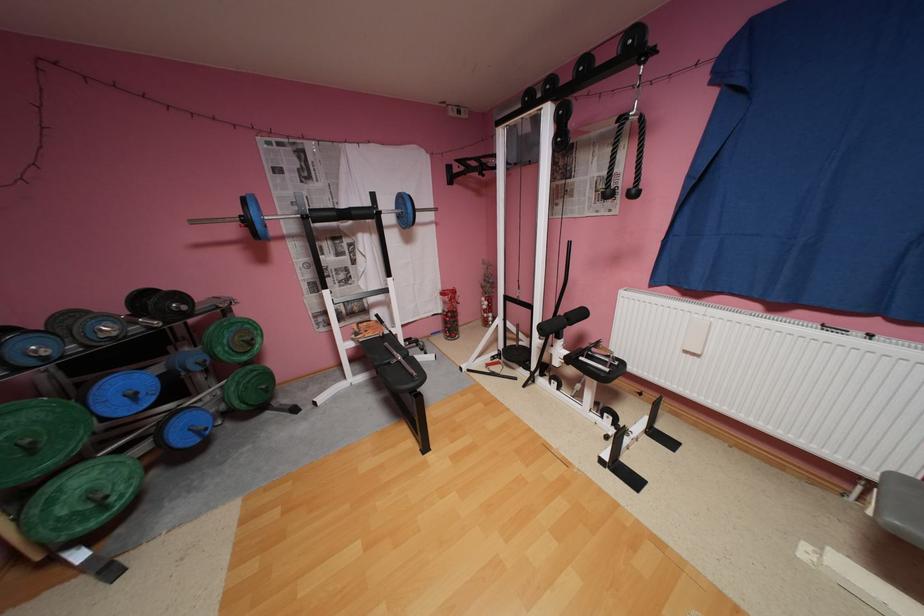
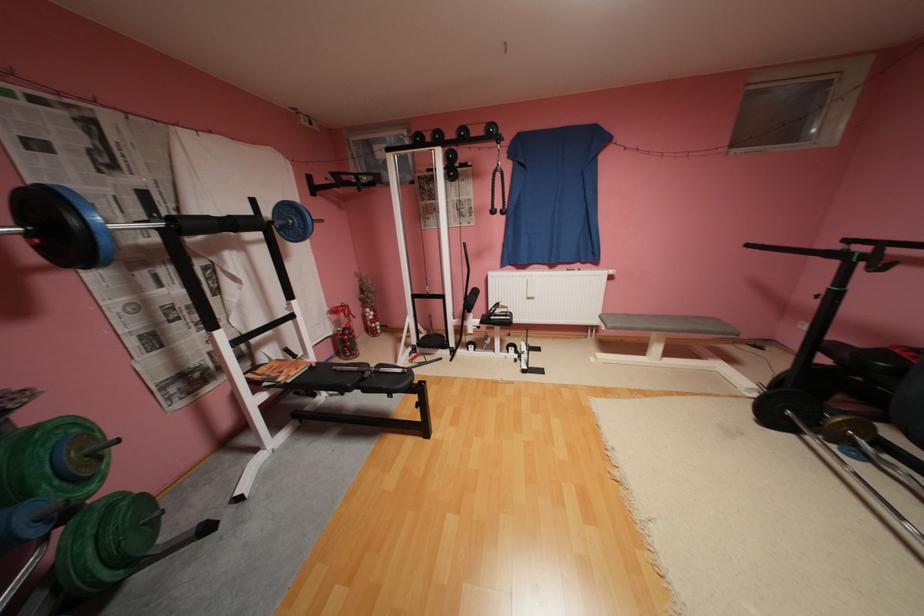
In the second image, find the point that corresponds to [241,387] in the first image.

(100, 551)